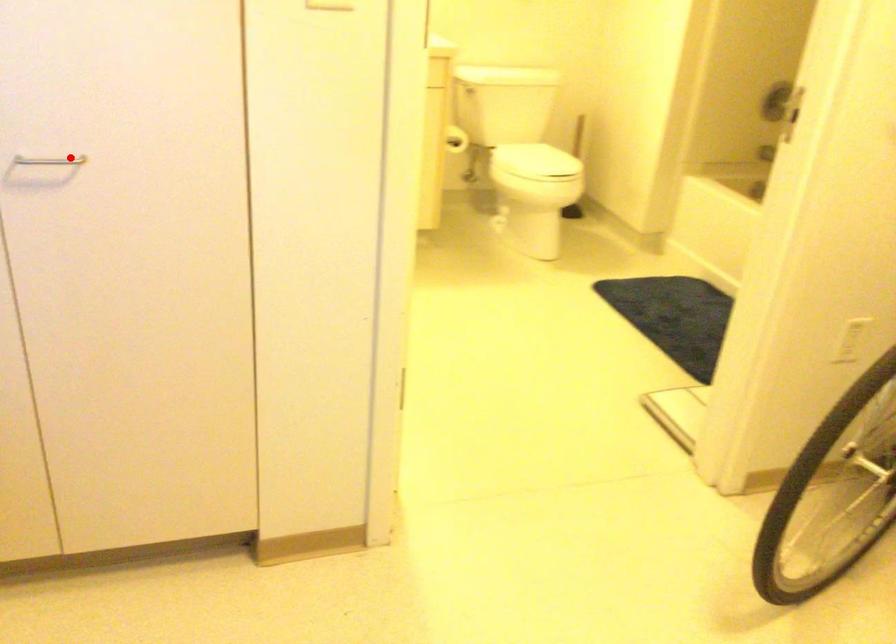
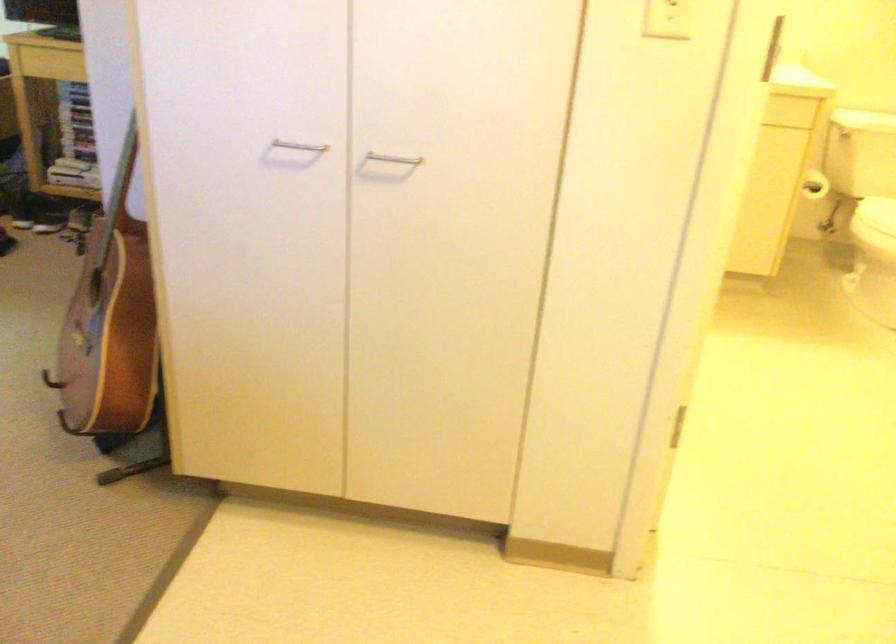
Question: I am providing you with two images of the same scene from different viewpoints. Image1 has a red point marked. In image2, the corresponding 3D location appears at what relative position? Reply with the corresponding letter.

Choices:
 (A) Closer
 (B) Farther

Answer: (B)